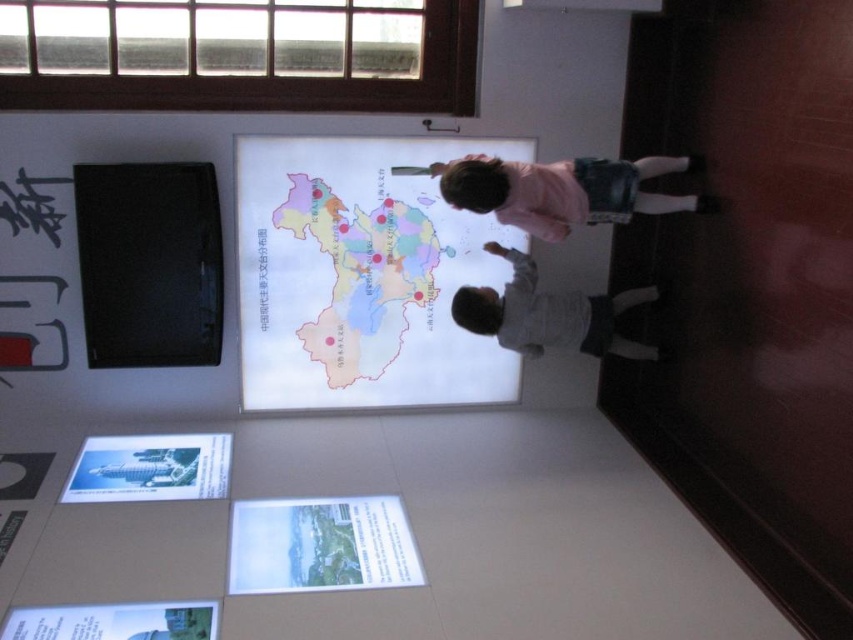
You are standing in the museum and see two points marked on the map. The first point is at coordinates point (502, 276) and the second point is at coordinates point (561, 168). Which point is closer to you?

Point (561, 168) is closer to you because it is in front of point (502, 276).

You are a security guard in the museum and need to ensure that the white matte map at center is within the 25 inch safety zone from the pink fabric at upper right to prevent fire hazards. Are you compliant with the safety regulations?

The white matte map at center is 24.96 inches away from the pink fabric at upper right, which is within the 25 inch safety zone. Therefore, the safety regulations are being followed.

You are a tour guide in the museum and want to ensure all visitors can see the map at center clearly. The gray cotton shirt at lower center is blocking the view. How can you adjust their position?

The gray cotton shirt at lower center is behind the map at center, so to ensure a clear view of the map at center, you should ask the gray cotton shirt at lower center to move forward in front of the map at center.